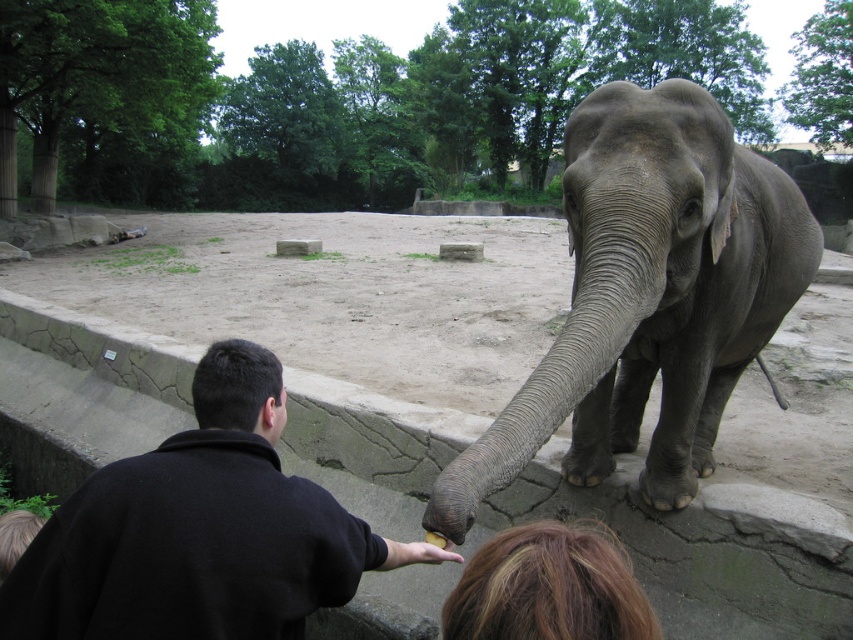
Question: Which point is farther from the camera taking this photo?

Choices:
 (A) (628, 224)
 (B) (241, 440)

Answer: (A)

Question: Is gray matte elephant at center further to camera compared to black fleece jacket at lower left?

Choices:
 (A) no
 (B) yes

Answer: (B)

Question: Among these points, which one is farthest from the camera?

Choices:
 (A) (616, 145)
 (B) (175, 500)

Answer: (A)

Question: Is the position of gray matte elephant at center more distant than that of black fleece jacket at lower left?

Choices:
 (A) yes
 (B) no

Answer: (A)

Question: Is gray matte elephant at center to the left of black fleece jacket at lower left from the viewer's perspective?

Choices:
 (A) yes
 (B) no

Answer: (B)